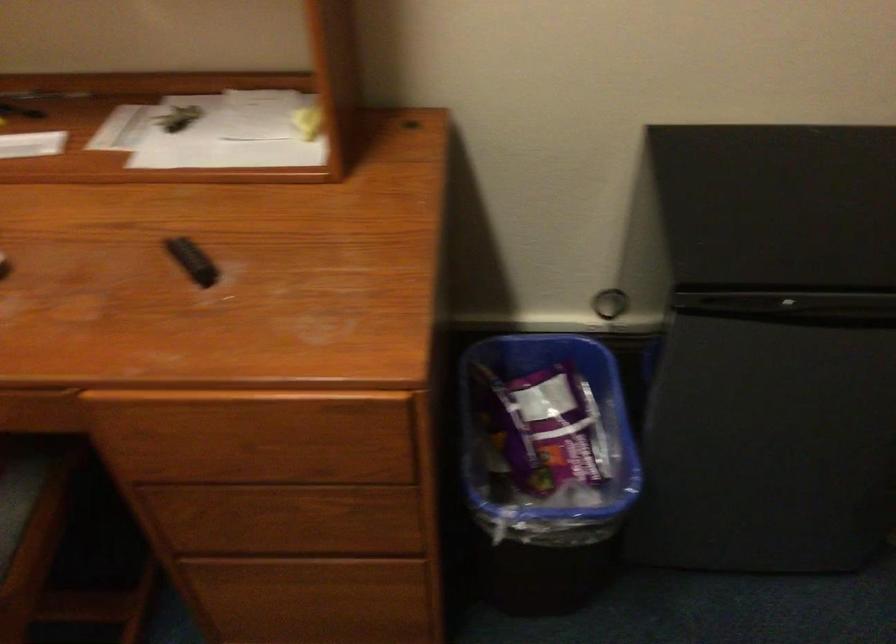
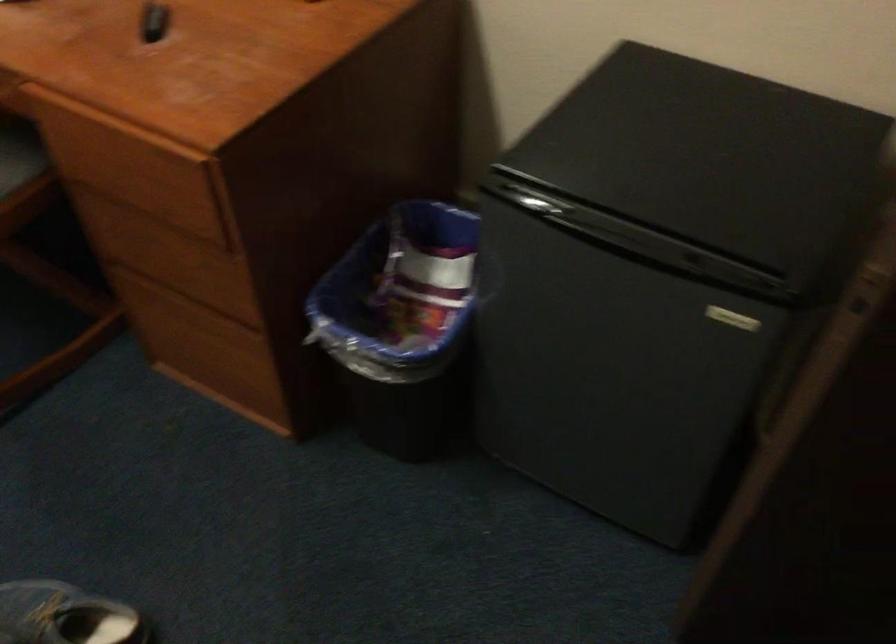
Question: The images are taken continuously from a first-person perspective. In which direction are you moving?

Choices:
 (A) Left
 (B) Right
 (C) Forward
 (D) Backward

Answer: (B)